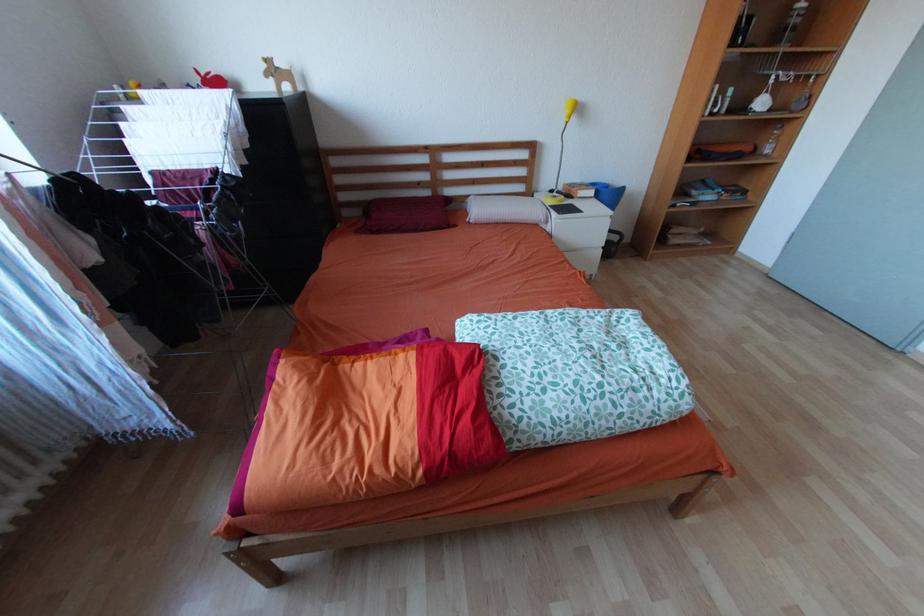
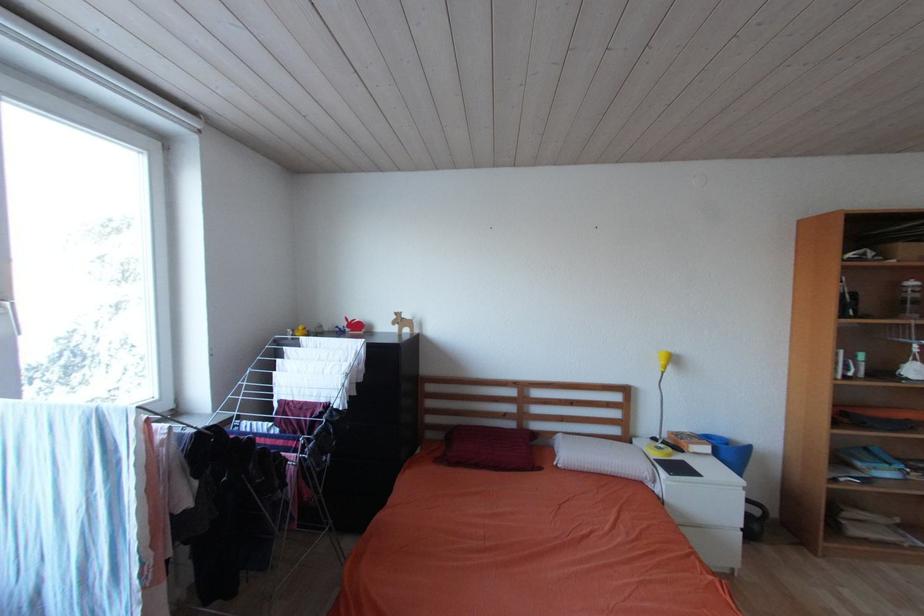
How did the camera likely rotate?

The rotation direction of the camera is left-up.